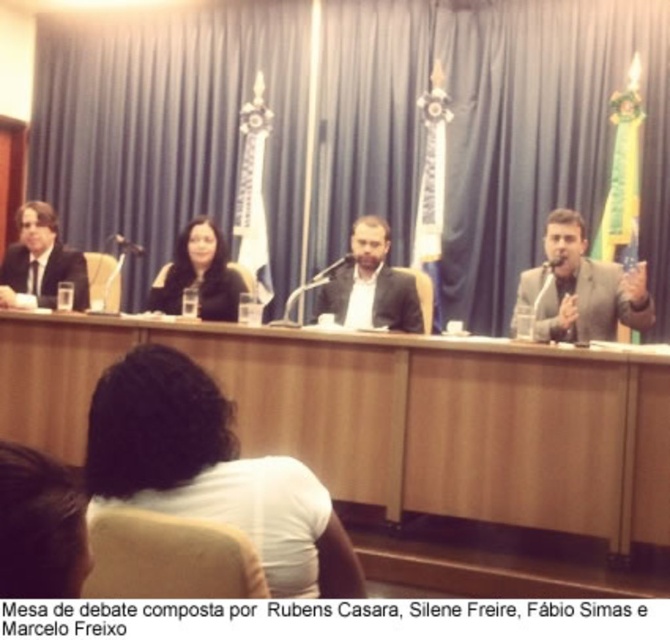
Question: Is dark brown hair at lower left behind matte black suit at center?

Choices:
 (A) no
 (B) yes

Answer: (A)

Question: Which of the following is the farthest from the observer?

Choices:
 (A) (354, 269)
 (B) (232, 410)
 (C) (184, 250)

Answer: (A)

Question: Is white fabric shirt at center to the right of matte black jacket at center from the viewer's perspective?

Choices:
 (A) no
 (B) yes

Answer: (B)

Question: Does gray suit at right appear under matte black jacket at center?

Choices:
 (A) yes
 (B) no

Answer: (A)

Question: Which point is closer to the camera taking this photo?

Choices:
 (A) (176, 280)
 (B) (594, 561)

Answer: (B)

Question: Considering the real-world distances, which object is farthest from the wooden table at center?

Choices:
 (A) matte black suit at left
 (B) matte black suit at center

Answer: (A)